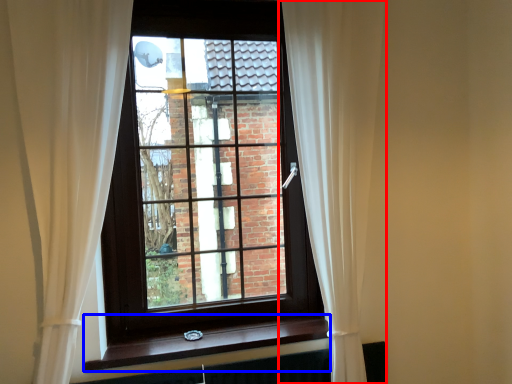
Question: Which of the following is the closest to the observer, curtain (highlighted by a red box) or window sill (highlighted by a blue box)?

Choices:
 (A) curtain
 (B) window sill

Answer: (A)